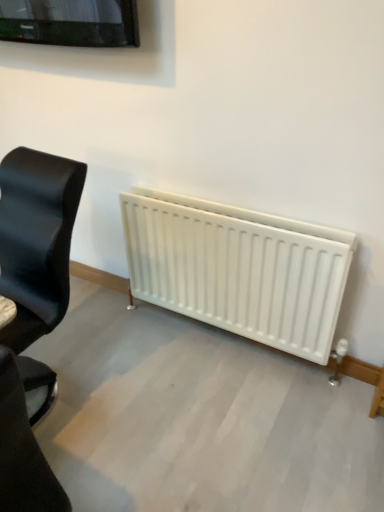
Question: In terms of size, does black leather chair at left, which is counted as the first chair, starting from the back, appear bigger or smaller than black leather chair at lower left, positioned as the first chair in front-to-back order?

Choices:
 (A) big
 (B) small

Answer: (A)

Question: From the image's perspective, is black leather chair at left, which is counted as the first chair, starting from the back, positioned above or below black leather chair at lower left, positioned as the first chair in front-to-back order?

Choices:
 (A) above
 (B) below

Answer: (A)

Question: In terms of width, does black leather chair at left, which is counted as the first chair, starting from the back, look wider or thinner when compared to black leather chair at lower left, arranged as the second chair when viewed from the back?

Choices:
 (A) thin
 (B) wide

Answer: (A)

Question: Is black leather chair at lower left, arranged as the second chair when viewed from the back, taller or shorter than black leather chair at left, which is counted as the first chair, starting from the back?

Choices:
 (A) tall
 (B) short

Answer: (A)

Question: Would you say black leather chair at lower left, arranged as the second chair when viewed from the back, is to the left or to the right of black leather chair at left, which is counted as the first chair, starting from the back, in the picture?

Choices:
 (A) left
 (B) right

Answer: (B)

Question: Relative to black leather chair at left, the 2th chair when ordered from front to back, is black leather chair at lower left, arranged as the second chair when viewed from the back, in front or behind?

Choices:
 (A) front
 (B) behind

Answer: (A)

Question: From the image's perspective, relative to black leather chair at left, the 2th chair when ordered from front to back, is black leather chair at lower left, arranged as the second chair when viewed from the back, above or below?

Choices:
 (A) above
 (B) below

Answer: (B)